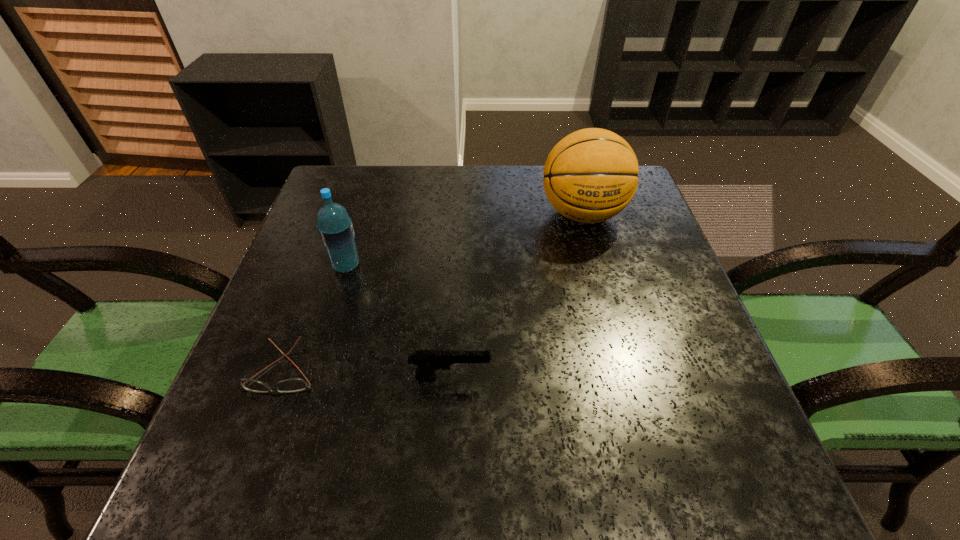
Image resolution: width=960 pixels, height=540 pixels. I want to click on basketball, so click(x=591, y=175).

Image resolution: width=960 pixels, height=540 pixels. In order to click on the rightmost object in this screenshot , I will do `click(591, 175)`.

You are a GUI agent. You are given a task and a screenshot of the screen. Output one action in this format:
    pyautogui.click(x=<x>, y=<y>)
    Task: Click on the water bottle
    
    Given the screenshot: What is the action you would take?
    pyautogui.click(x=335, y=228)

Where is `pistol`? The width and height of the screenshot is (960, 540). pistol is located at coordinates (428, 361).

The width and height of the screenshot is (960, 540). Identify the location of the second object from right to left. (428, 361).

Locate an element on the screen. Image resolution: width=960 pixels, height=540 pixels. the shortest object is located at coordinates (292, 385).

Identify the location of vacant region located 0.220m on the surface of the rightmost object near the brand logo. This screenshot has width=960, height=540. (609, 310).

In order to click on vacant point located 0.350m on the front of the second farthest object in this screenshot , I will do `click(298, 422)`.

You are a GUI agent. You are given a task and a screenshot of the screen. Output one action in this format:
    pyautogui.click(x=<x>, y=<y>)
    Task: Click on the blank space located on the front-facing side of the pistol
    
    Given the screenshot: What is the action you would take?
    (x=691, y=377)

This screenshot has width=960, height=540. I want to click on free space located 0.130m on the front-facing side of the shortest object, so click(x=248, y=469).